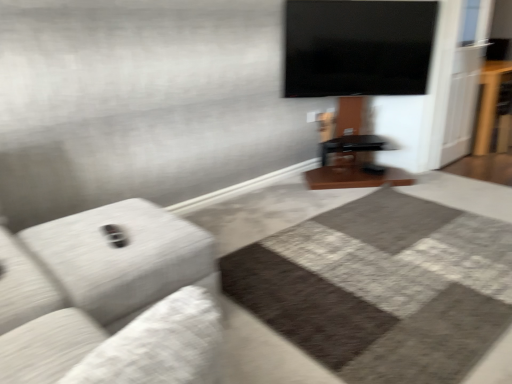
Question: Should I look upward or downward to see light gray fabric couch at left?

Choices:
 (A) up
 (B) down

Answer: (B)

Question: Does light gray fabric couch at left turn towards brown wooden table at right?

Choices:
 (A) no
 (B) yes

Answer: (B)

Question: Does light gray fabric couch at left have a larger size compared to brown wooden table at right?

Choices:
 (A) yes
 (B) no

Answer: (B)

Question: Considering the relative sizes of light gray fabric couch at left and brown wooden table at right in the image provided, is light gray fabric couch at left wider than brown wooden table at right?

Choices:
 (A) yes
 (B) no

Answer: (A)

Question: Considering the relative sizes of light gray fabric couch at left and brown wooden table at right in the image provided, is light gray fabric couch at left taller than brown wooden table at right?

Choices:
 (A) no
 (B) yes

Answer: (A)

Question: Is light gray fabric couch at left positioned in front of brown wooden table at right?

Choices:
 (A) yes
 (B) no

Answer: (A)

Question: Is light gray fabric couch at left positioned with its back to brown wooden table at right?

Choices:
 (A) no
 (B) yes

Answer: (A)

Question: Is brown wooden table at right at the right side of light gray fabric couch at left?

Choices:
 (A) no
 (B) yes

Answer: (B)

Question: Is brown wooden table at right to the left of light gray fabric couch at left from the viewer's perspective?

Choices:
 (A) yes
 (B) no

Answer: (B)

Question: Does brown wooden table at right have a lesser height compared to light gray fabric couch at left?

Choices:
 (A) yes
 (B) no

Answer: (B)

Question: From a real-world perspective, does brown wooden table at right stand above light gray fabric couch at left?

Choices:
 (A) no
 (B) yes

Answer: (B)

Question: From a real-world perspective, is brown wooden table at right positioned under light gray fabric couch at left based on gravity?

Choices:
 (A) no
 (B) yes

Answer: (A)

Question: Is brown wooden table at right wider than light gray fabric couch at left?

Choices:
 (A) no
 (B) yes

Answer: (A)

Question: Is brown wooden table at right taller or shorter than light gray fabric couch at left?

Choices:
 (A) tall
 (B) short

Answer: (A)